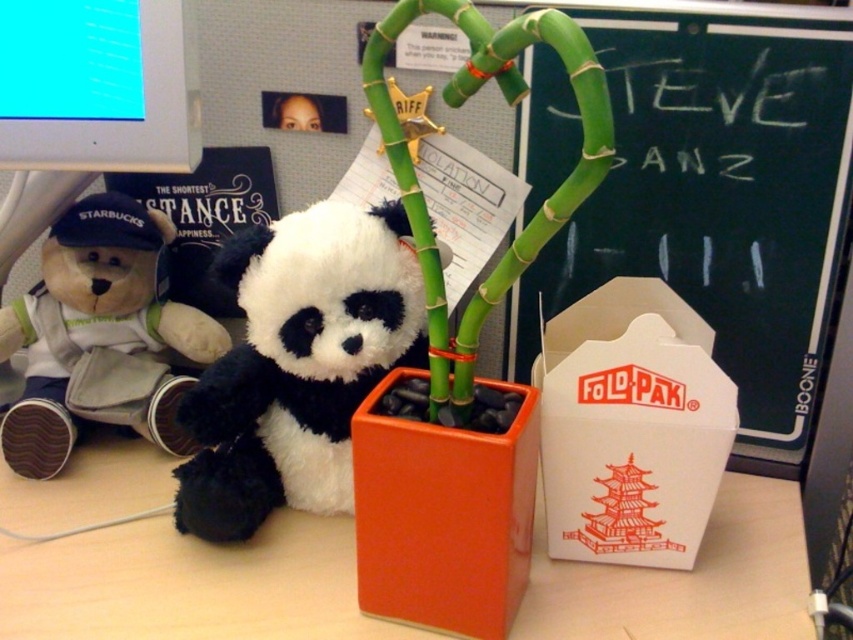
Question: Which point appears farthest from the camera in this image?

Choices:
 (A) (602, 589)
 (B) (48, 285)
 (C) (439, 518)
 (D) (277, 492)

Answer: (B)

Question: Among these objects, which one is farthest from the camera?

Choices:
 (A) soft plush panda at center
 (B) matte plastic monitor at upper left
 (C) white paper box at center

Answer: (B)

Question: Observing the image, what is the correct spatial positioning of black chalkboard at upper right in reference to matte plastic monitor at upper left?

Choices:
 (A) right
 (B) left

Answer: (A)

Question: Can you confirm if soft plush panda at center is smaller than green bamboo at center?

Choices:
 (A) yes
 (B) no

Answer: (A)

Question: Which object is farther from the camera taking this photo?

Choices:
 (A) orange glossy cube at center
 (B) brown plush bear at left
 (C) matte plastic monitor at upper left
 (D) white paper box at center

Answer: (B)

Question: In this image, where is soft plush panda at center located relative to brown plush bear at left?

Choices:
 (A) right
 (B) left

Answer: (A)